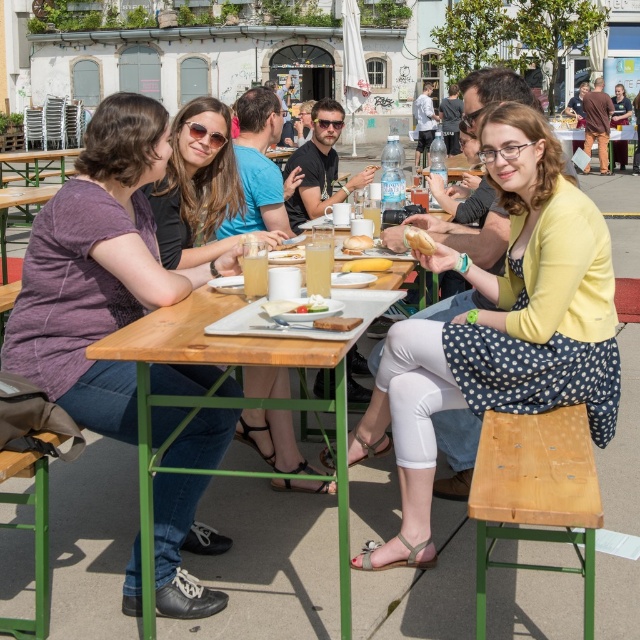
Question: Does wooden table at center have a lesser width compared to white glossy plate at center?

Choices:
 (A) yes
 (B) no

Answer: (B)

Question: Which object appears farthest from the camera in this image?

Choices:
 (A) light brown wooden stool at lower right
 (B) white matte plate at center
 (C) white glossy plate at center
 (D) polka dot dress at center

Answer: (D)

Question: Can you confirm if polka dot dress at center is smaller than purple cotton shirt at upper left?

Choices:
 (A) no
 (B) yes

Answer: (B)

Question: Which point is farther to the camera?

Choices:
 (A) matte black shirt at center
 (B) white bread at table center
 (C) white matte plate at center

Answer: (B)

Question: Based on their relative distances, which object is farther from the purple cotton shirt at upper left?

Choices:
 (A) polka dot dress at center
 (B) white bread at center
 (C) white glossy plate at center
 (D) white matte plate at center

Answer: (A)

Question: Is purple cotton shirt at upper left positioned in front of golden bread at center?

Choices:
 (A) yes
 (B) no

Answer: (A)